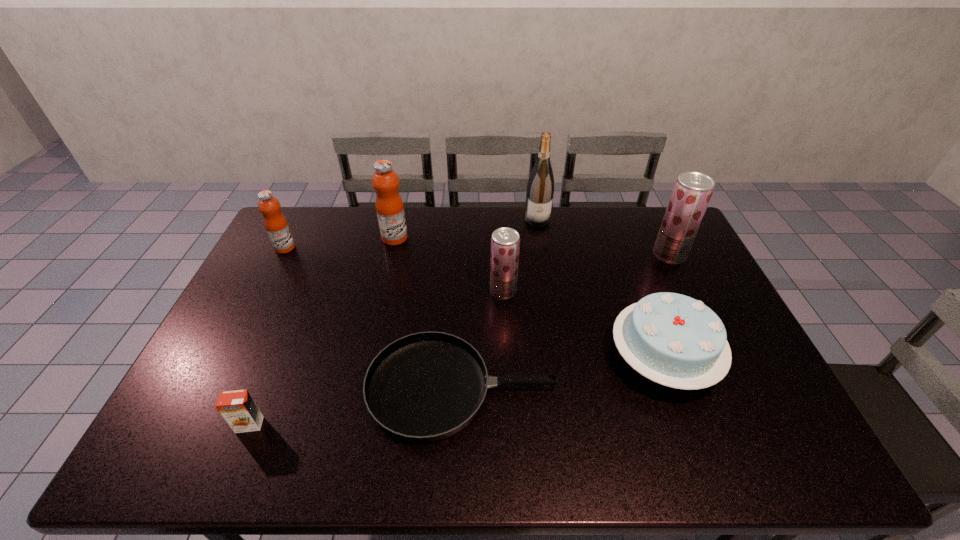
Find the location of a particular element. blue birthday cake is located at coordinates (672, 339).

The image size is (960, 540). Find the location of `birthday cake`. birthday cake is located at coordinates (672, 339).

You are a GUI agent. You are given a task and a screenshot of the screen. Output one action in this format:
    pyautogui.click(x=<x>, y=<y>)
    Task: Click on the second shortest object
    The width and height of the screenshot is (960, 540).
    Given the screenshot: What is the action you would take?
    pyautogui.click(x=239, y=410)

In order to click on orange orange juice in this screenshot , I will do `click(239, 410)`.

Identify the location of black frying pan. (424, 387).

Identify the location of frying pan. (424, 387).

You are a GUI agent. You are given a task and a screenshot of the screen. Output one action in this format:
    pyautogui.click(x=<x>, y=<y>)
    Task: Click on the free space located 0.180m on the label of the wine bottle
    This screenshot has height=540, width=960.
    Given the screenshot: What is the action you would take?
    pyautogui.click(x=543, y=258)

The height and width of the screenshot is (540, 960). In order to click on free spot located 0.150m on the left of the bigger strawberry fruit juice in this screenshot , I will do `click(610, 255)`.

Identify the location of vacant space located 0.060m on the front label of the second fruit juice from left to right. The height and width of the screenshot is (540, 960). (424, 238).

At what (x,y) coordinates should I click in order to perform the action: click on vacant region located on the left of the nearest fruit juice. Please return your answer as a coordinate pair (x, y). Looking at the image, I should click on (430, 291).